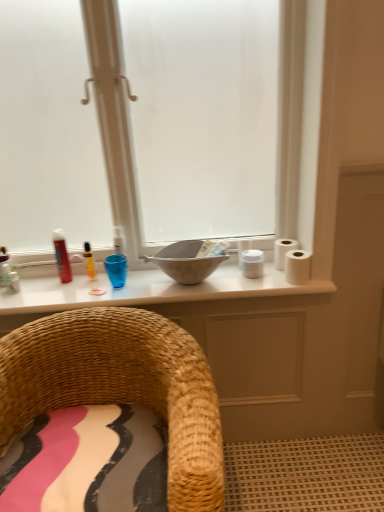
You are a GUI agent. You are given a task and a screenshot of the screen. Output one action in this format:
    pyautogui.click(x=<x>, y=<y>)
    Task: Click on the vacant space in front of matte red can at left, the 1th toiletry viewed from the left
    The height and width of the screenshot is (512, 384).
    Given the screenshot: What is the action you would take?
    pyautogui.click(x=56, y=293)